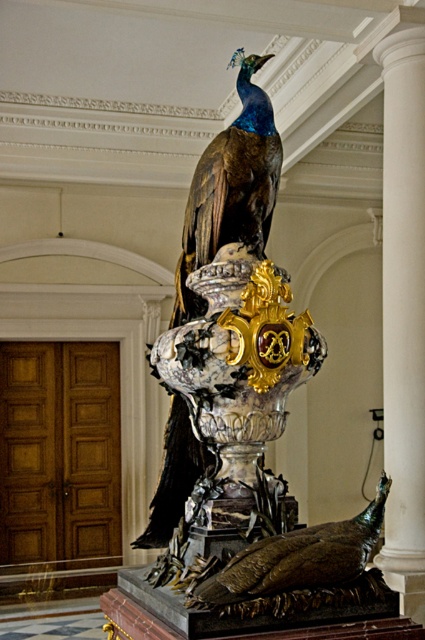
Is white marble column at center bigger than shiny bronze peacock at center?

Indeed, white marble column at center has a larger size compared to shiny bronze peacock at center.

Between white marble column at center and shiny bronze peacock at center, which one has more height?

white marble column at center

What do you see at coordinates (404, 304) in the screenshot? Image resolution: width=425 pixels, height=640 pixels. I see `white marble column at center` at bounding box center [404, 304].

I want to click on white marble column at center, so click(x=404, y=304).

Is shiny bronze peacock at upper center to the left of white marble column at center from the viewer's perspective?

Correct, you'll find shiny bronze peacock at upper center to the left of white marble column at center.

Which is behind, point (241, 116) or point (384, 348)?

The point (384, 348) is more distant.

Is point (246, 221) farther from camera compared to point (419, 417)?

No, (246, 221) is closer to viewer.

Image resolution: width=425 pixels, height=640 pixels. I want to click on shiny bronze peacock at upper center, so click(243, 420).

Is white marble column at center further to camera compared to shiny blue peacock at center?

That is True.

Find the location of `white marble column at center`. white marble column at center is located at coordinates (404, 304).

Where is `white marble column at center`? white marble column at center is located at coordinates (404, 304).